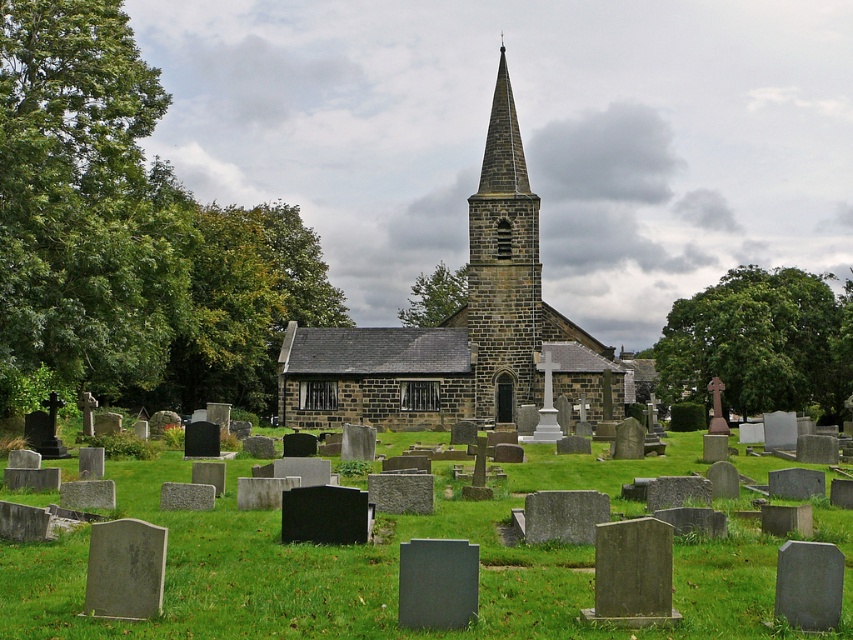
You are standing in the cemetery looking towards the church. Which object, the green leafy tree at right or the brown stone steeple at center, is positioned lower in the scene?

The green leafy tree at right is positioned lower than the brown stone steeple at center in the scene.